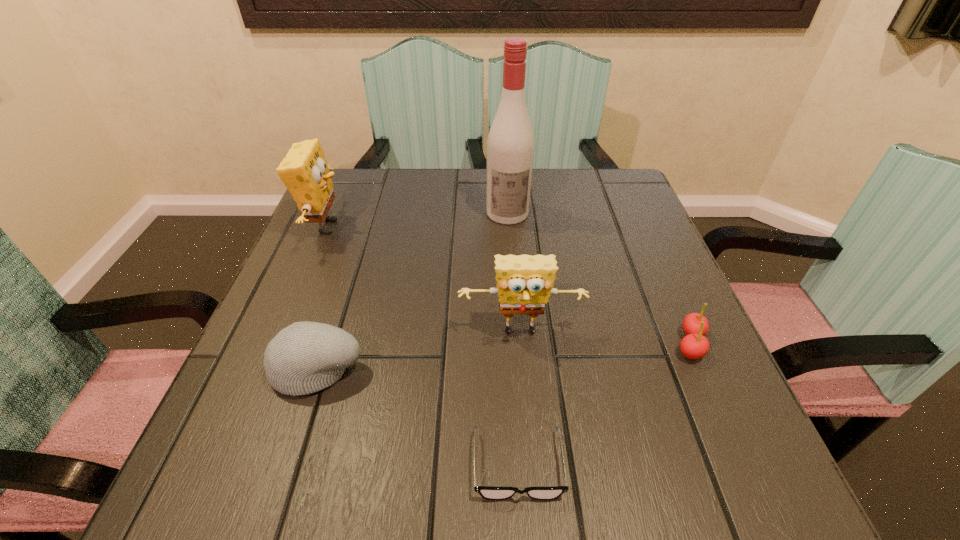
Image resolution: width=960 pixels, height=540 pixels. What are the coordinates of `object situated at the right edge` in the screenshot? It's located at (694, 345).

This screenshot has width=960, height=540. In order to click on object that is at the far left corner in this screenshot , I will do `click(304, 170)`.

This screenshot has width=960, height=540. I want to click on vacant space at the far edge of the desktop, so click(x=414, y=170).

The image size is (960, 540). What are the coordinates of `vacant space at the near edge of the desktop` in the screenshot? It's located at (600, 506).

Find the location of `free space at the left edge of the desktop`. free space at the left edge of the desktop is located at coordinates (306, 247).

The width and height of the screenshot is (960, 540). I want to click on vacant area at the right edge of the desktop, so click(x=617, y=222).

This screenshot has width=960, height=540. I want to click on vacant point at the far right corner, so click(610, 194).

Locate an element on the screen. The image size is (960, 540). vacant space at the near right corner is located at coordinates (759, 454).

Find the location of a particular element. Image resolution: width=960 pixels, height=540 pixels. unoccupied position between the spectacles and the rightmost object is located at coordinates (604, 404).

Where is `free spot between the shorter sponge and the fourth tallest object`? free spot between the shorter sponge and the fourth tallest object is located at coordinates (420, 350).